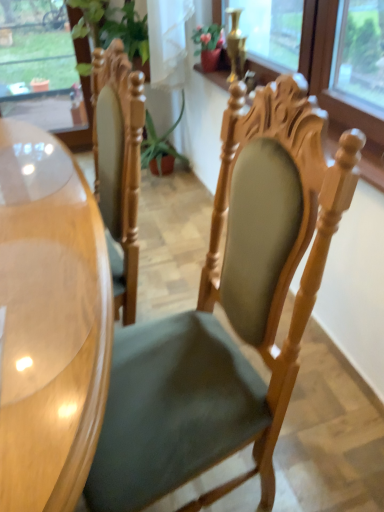
Question: Can you confirm if transparent glass window at upper left is thinner than green fabric chair at center?

Choices:
 (A) yes
 (B) no

Answer: (A)

Question: From the image's perspective, does transparent glass window at upper left appear higher than green fabric chair at center?

Choices:
 (A) no
 (B) yes

Answer: (B)

Question: Is transparent glass window at upper left wider than green fabric chair at center?

Choices:
 (A) no
 (B) yes

Answer: (A)

Question: From a real-world perspective, is transparent glass window at upper left over green fabric chair at center?

Choices:
 (A) yes
 (B) no

Answer: (A)

Question: Is transparent glass window at upper left positioned in front of green fabric chair at center?

Choices:
 (A) no
 (B) yes

Answer: (A)

Question: Is point (29, 2) positioned closer to the camera than point (31, 288)?

Choices:
 (A) closer
 (B) farther

Answer: (B)

Question: Is transparent glass window at upper left in front of or behind glossy wood desk at left in the image?

Choices:
 (A) front
 (B) behind

Answer: (B)

Question: From a real-world perspective, is transparent glass window at upper left positioned above or below glossy wood desk at left?

Choices:
 (A) below
 (B) above

Answer: (B)

Question: In terms of size, does transparent glass window at upper left appear bigger or smaller than glossy wood desk at left?

Choices:
 (A) big
 (B) small

Answer: (B)

Question: In the image, is transparent glass window at upper left positioned in front of or behind green fabric chair at center?

Choices:
 (A) front
 (B) behind

Answer: (B)

Question: In terms of width, does transparent glass window at upper left look wider or thinner when compared to green fabric chair at center?

Choices:
 (A) thin
 (B) wide

Answer: (A)

Question: In terms of size, does transparent glass window at upper left appear bigger or smaller than green fabric chair at center?

Choices:
 (A) small
 (B) big

Answer: (A)

Question: Is point (0, 57) closer or farther from the camera than point (124, 357)?

Choices:
 (A) closer
 (B) farther

Answer: (B)

Question: Which is correct: green fabric chair at center is inside glossy wood desk at left, or outside of it?

Choices:
 (A) outside
 (B) inside

Answer: (A)

Question: From a real-world perspective, is green fabric chair at center above or below glossy wood desk at left?

Choices:
 (A) above
 (B) below

Answer: (A)